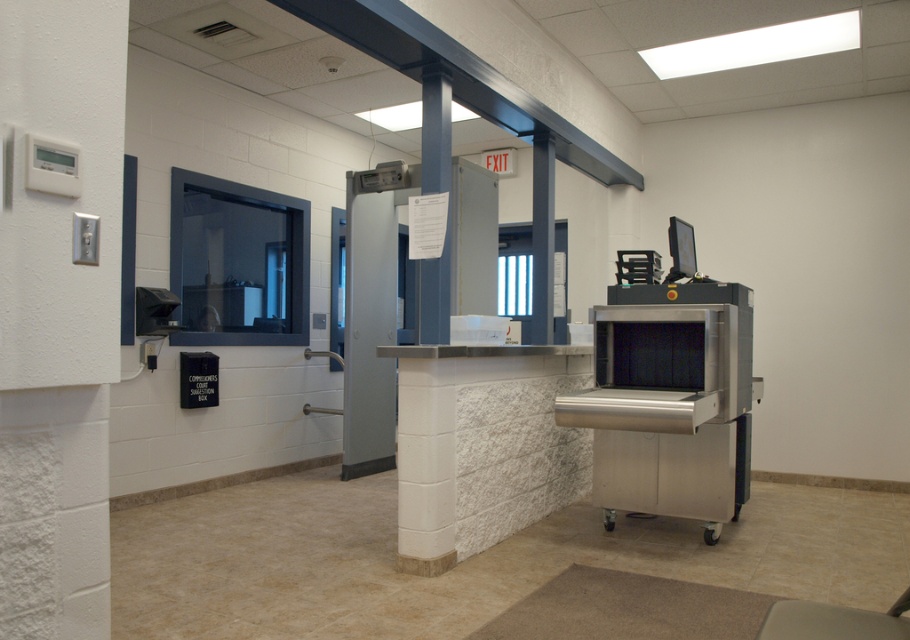
Is point (12, 284) closer to camera compared to point (347, 408)?

Yes, it is in front of point (347, 408).

Can you confirm if white textured wall at left is thinner than gray metallic door at center?

Correct, white textured wall at left's width is less than gray metallic door at center's.

Is point (4, 36) positioned in front of point (351, 284)?

Yes, point (4, 36) is in front of point (351, 284).

Image resolution: width=910 pixels, height=640 pixels. I want to click on white textured wall at left, so click(x=58, y=316).

Is point (447, 243) closer to viewer compared to point (881, 614)?

That is False.

The image size is (910, 640). I want to click on blue glossy pillar at center, so click(x=435, y=131).

Between point (346, 401) and point (543, 218), which one is positioned in front?

Positioned in front is point (543, 218).

Is point (354, 198) positioned in front of point (538, 132)?

That is False.

Find the location of a particular element. gray metallic door at center is located at coordinates [x=369, y=326].